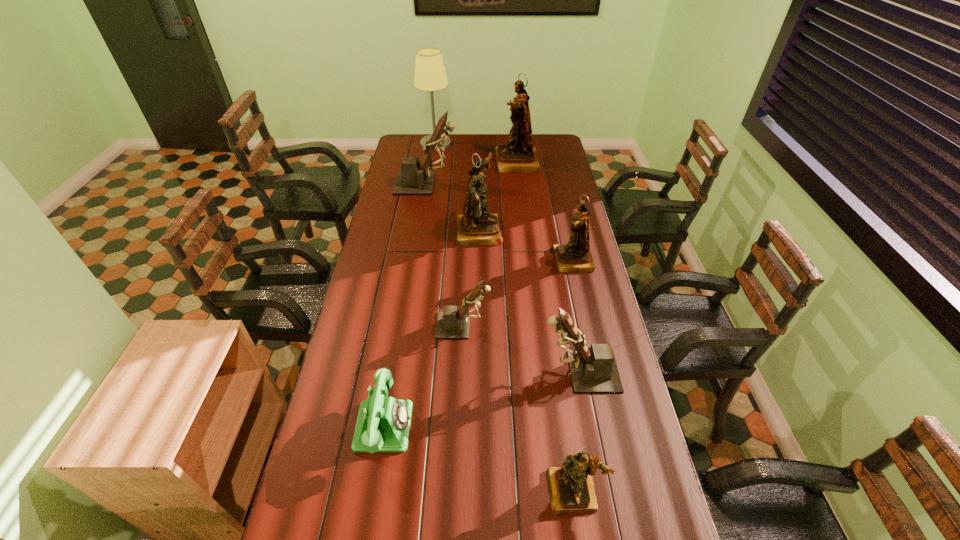
Locate which gold figurine ranks in proximity to the fifth nearest object. Please provide its 2D coordinates. Your answer should be formatted as a tuple, i.e. [(x, y)], where the tuple contains the x and y coordinates of a point satisfying the conditions above.

[(476, 226)]

Identify the location of gold figurine object that ranks as the second closest to the smallest gold figurine. (476, 226).

At what (x,y) coordinates should I click in order to perform the action: click on the second closest brown figurine relative to the nearest brown figurine. Please return your answer as a coordinate pair (x, y). Looking at the image, I should click on (413, 179).

Identify which brown figurine is the second closest to the smallest brown figurine. Please provide its 2D coordinates. Your answer should be formatted as a tuple, i.e. [(x, y)], where the tuple contains the x and y coordinates of a point satisfying the conditions above.

[(413, 179)]

Image resolution: width=960 pixels, height=540 pixels. Find the location of `vacant space that satisfies the following two spatial constraints: 1. on the front-facing side of the second nearest gold figurine; 2. on the front-facing side of the smallest gold figurine`. vacant space that satisfies the following two spatial constraints: 1. on the front-facing side of the second nearest gold figurine; 2. on the front-facing side of the smallest gold figurine is located at coordinates (625, 491).